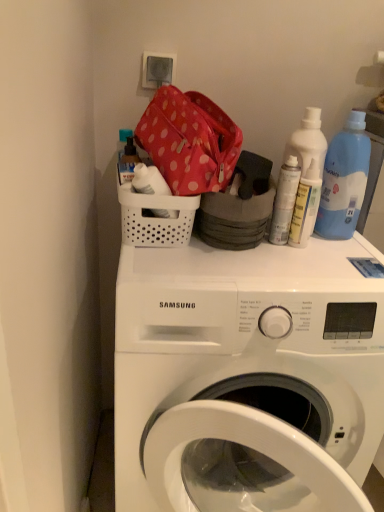
Find the location of a particular element. unoccupied area in front of blue plastic bottle at upper right is located at coordinates (335, 256).